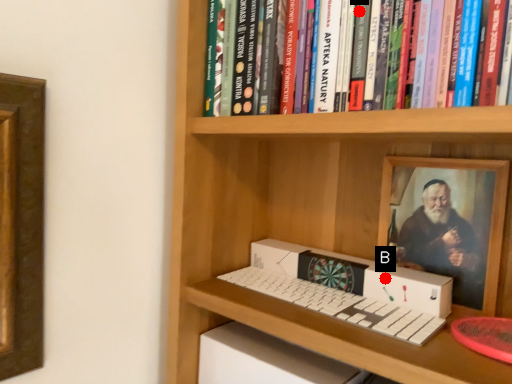
Question: Two points are circled on the image, labeled by A and B beside each circle. Which point is further to the camera?

Choices:
 (A) A is further
 (B) B is further

Answer: (B)